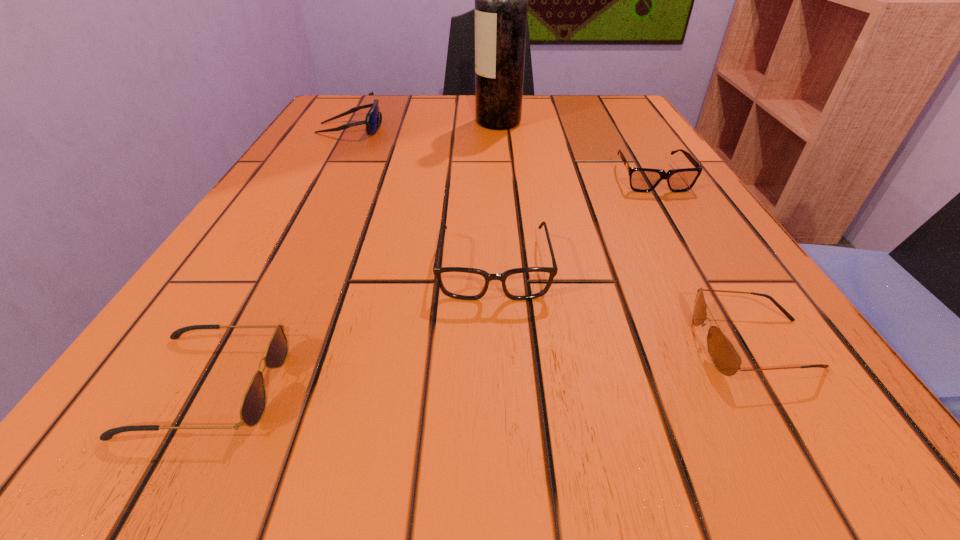
At what (x,y) coordinates should I click in order to perform the action: click on liquor. Please return your answer as a coordinate pair (x, y). The height and width of the screenshot is (540, 960). Looking at the image, I should click on (501, 0).

Locate an element on the screen. the tallest sunglasses is located at coordinates (373, 119).

You are a GUI agent. You are given a task and a screenshot of the screen. Output one action in this format:
    pyautogui.click(x=<x>, y=<y>)
    Task: Click on the spectacles
    Image resolution: width=960 pixels, height=540 pixels.
    Given the screenshot: What is the action you would take?
    pyautogui.click(x=463, y=283)

Image resolution: width=960 pixels, height=540 pixels. I want to click on the fourth nearest object, so click(641, 179).

You are a GUI agent. You are given a task and a screenshot of the screen. Output one action in this format:
    pyautogui.click(x=<x>, y=<y>)
    Task: Click on the vacant space located 0.210m on the front-facing side of the liquor
    The height and width of the screenshot is (540, 960).
    Given the screenshot: What is the action you would take?
    pyautogui.click(x=383, y=122)

Identify the location of free space located on the front-facing side of the liquor. This screenshot has width=960, height=540. (387, 122).

The width and height of the screenshot is (960, 540). In order to click on vacant space positioned on the front-facing side of the liquor in this screenshot , I will do `click(339, 122)`.

Find the location of a particular element. free space located on the front-facing side of the farthest sunglasses is located at coordinates (415, 129).

I want to click on vacant position located on the front-facing side of the spectacles, so click(x=500, y=454).

You are a GUI agent. You are given a task and a screenshot of the screen. Output one action in this format:
    pyautogui.click(x=<x>, y=<y>)
    Task: Click on the vacant space located 0.200m on the front-facing side of the third nearest sunglasses
    
    Given the screenshot: What is the action you would take?
    pyautogui.click(x=707, y=268)